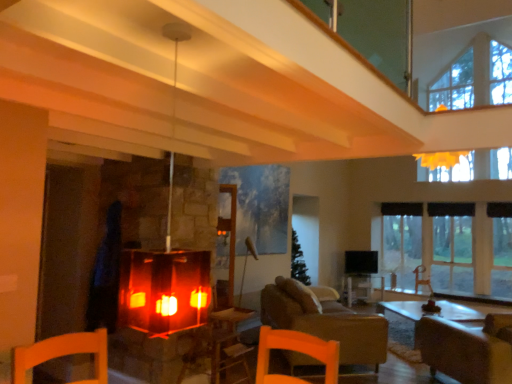
Locate an element on the screen. This screenshot has width=512, height=384. wooden table at center is located at coordinates (362, 288).

What do you see at coordinates (402, 209) in the screenshot? This screenshot has height=384, width=512. I see `black fabric curtain at right` at bounding box center [402, 209].

Where is `matte glass fireplace at center`? This screenshot has height=384, width=512. matte glass fireplace at center is located at coordinates (164, 284).

Can we say black fabric curtain at right lies outside brown leather armchair at lower right, arranged as the first armchair when viewed from the right?

black fabric curtain at right lies outside brown leather armchair at lower right, arranged as the first armchair when viewed from the right,'s area.

Is point (417, 207) closer or farther from the camera than point (422, 273)?

Point (417, 207) is positioned farther from the camera compared to point (422, 273).

Is black fabric curtain at right positioned in front of brown leather armchair at lower right, the second armchair viewed from the left?

No, it is not.

From the image's perspective, is black fabric curtain at right on brown leather armchair at lower right, the second armchair from the front?

Yes, from the image's perspective, black fabric curtain at right is on top of brown leather armchair at lower right, the second armchair from the front.

From the image's perspective, does brown leather armchair at lower right, the second armchair positioned from the right, appear lower than black fabric curtain at right?

Yes.

Is brown leather armchair at lower right, the 1th armchair positioned from the left, far from black fabric curtain at right?

brown leather armchair at lower right, the 1th armchair positioned from the left, is far away from black fabric curtain at right.

Is point (493, 333) in front of point (396, 214)?

Yes.

Which is more to the right, brown leather armchair at lower right, the 1th armchair positioned from the left, or black fabric curtain at right?

From the viewer's perspective, black fabric curtain at right appears more on the right side.

Between black fabric curtain at right and brown leather armchair at lower right, which ranks as the second armchair in back-to-front order, which one has larger size?

brown leather armchair at lower right, which ranks as the second armchair in back-to-front order.

From a real-world perspective, is black fabric curtain at right physically below brown leather armchair at lower right, which ranks as the second armchair in back-to-front order?

No, from a real-world perspective, black fabric curtain at right is not below brown leather armchair at lower right, which ranks as the second armchair in back-to-front order.

From the picture: Considering the sizes of black fabric curtain at right and brown leather armchair at lower right, the second armchair positioned from the right, in the image, is black fabric curtain at right wider or thinner than brown leather armchair at lower right, the second armchair positioned from the right,?

Clearly, black fabric curtain at right has less width compared to brown leather armchair at lower right, the second armchair positioned from the right.

Is black fabric curtain at right to the right of brown leather armchair at lower right, which ranks as the second armchair in back-to-front order, from the viewer's perspective?

Correct, you'll find black fabric curtain at right to the right of brown leather armchair at lower right, which ranks as the second armchair in back-to-front order.

Is wooden table at center inside or outside of brown leather armchair at lower right, the 1th armchair positioned from the left?

wooden table at center is spatially situated outside brown leather armchair at lower right, the 1th armchair positioned from the left.

Who is bigger, wooden table at center or brown leather armchair at lower right, the 1th armchair positioned from the left?

brown leather armchair at lower right, the 1th armchair positioned from the left, is bigger.

Locate an element on the screen. This screenshot has height=384, width=512. the 2nd armchair above the wooden table at center (from the image's perspective) is located at coordinates (468, 349).

From a real-world perspective, is wooden table at center physically below brown leather armchair at lower right, the 1th armchair from the front?

Yes, from a real-world perspective, wooden table at center is below brown leather armchair at lower right, the 1th armchair from the front.

From a real-world perspective, is black fabric curtain at right located beneath wooden table at center?

No.

Is black fabric curtain at right next to wooden table at center and touching it?

No, black fabric curtain at right is not in contact with wooden table at center.

Is black fabric curtain at right taller than wooden table at center?

No, black fabric curtain at right is not taller than wooden table at center.

From the picture: Who is taller, transparent glass window at right or brown leather armchair at lower right, the second armchair from the front?

transparent glass window at right is taller.

Is transparent glass window at right next to brown leather armchair at lower right, arranged as the first armchair when viewed from the right?

No, transparent glass window at right is not with brown leather armchair at lower right, arranged as the first armchair when viewed from the right.

From the image's perspective, is transparent glass window at right located beneath brown leather armchair at lower right, positioned as the 1th armchair in back-to-front order?

Actually, transparent glass window at right appears above brown leather armchair at lower right, positioned as the 1th armchair in back-to-front order, in the image.

Looking at this image, is transparent glass window at right turned away from brown leather armchair at lower right, arranged as the first armchair when viewed from the right?

Yes, transparent glass window at right is positioned with its back facing brown leather armchair at lower right, arranged as the first armchair when viewed from the right.

Who is more distant, leather couch at center or black fabric curtain at right?

Positioned behind is black fabric curtain at right.

Where is `studio couch below the black fabric curtain at right (from the image's perspective)`? Image resolution: width=512 pixels, height=384 pixels. studio couch below the black fabric curtain at right (from the image's perspective) is located at coordinates (325, 321).

Could you tell me if leather couch at center is turned towards black fabric curtain at right?

No, leather couch at center is not aimed at black fabric curtain at right.

How different are the orientations of leather couch at center and black fabric curtain at right in degrees?

They differ by 137 degrees in their facing directions.

Locate an element on the screen. The image size is (512, 384). curtain on the left of the brown leather armchair at lower right, arranged as the first armchair when viewed from the right is located at coordinates (402, 209).

From a real-world perspective, count 2nd armchairs downward from the black fabric curtain at right and point to it. Please provide its 2D coordinates.

[(468, 349)]

Which object lies nearer to the anchor point matte glass fireplace at center, wooden table at center or brown leather armchair at lower right, which ranks as the second armchair in back-to-front order?

Based on the image, brown leather armchair at lower right, which ranks as the second armchair in back-to-front order, appears to be nearer to matte glass fireplace at center.

Looking at the image, which one is located further to wooden table at center, transparent glass window at right or matte glass fireplace at center?

Among the two, matte glass fireplace at center is located further to wooden table at center.

From the image, which object appears to be nearer to leather couch at center, brown leather armchair at lower right, the second armchair positioned from the right, or transparent glass window at right?

brown leather armchair at lower right, the second armchair positioned from the right, is closer to leather couch at center.

Looking at this image, estimate the real-world distances between objects in this image. Which object is further from wooden table at center, transparent glass window at right or brown leather armchair at lower right, the 1th armchair positioned from the left?

The object further to wooden table at center is brown leather armchair at lower right, the 1th armchair positioned from the left.

Based on their spatial positions, is transparent glass window at right or wooden table at center closer to black fabric curtain at right?

transparent glass window at right is positioned closer to the anchor black fabric curtain at right.

From the image, which object appears to be farther from brown leather armchair at lower right, which ranks as the second armchair in back-to-front order, transparent glass window at right or wooden table at center?

Based on the image, transparent glass window at right appears to be further to brown leather armchair at lower right, which ranks as the second armchair in back-to-front order.

Based on their spatial positions, is brown leather armchair at lower right, the second armchair viewed from the left, or leather couch at center further from matte glass fireplace at center?

brown leather armchair at lower right, the second armchair viewed from the left.

From the image, which object appears to be farther from leather couch at center, black fabric curtain at right or transparent glass window at right?

black fabric curtain at right is positioned further to the anchor leather couch at center.

The height and width of the screenshot is (384, 512). In order to click on window located between matte glass fireplace at center and wooden table at center in the depth direction in this screenshot , I will do `click(452, 248)`.

Image resolution: width=512 pixels, height=384 pixels. Identify the location of window between brown leather armchair at lower right, the 1th armchair from the front, and wooden table at center in the front-back direction. (452, 248).

This screenshot has width=512, height=384. I want to click on studio couch between matte glass fireplace at center and wooden table at center along the z-axis, so click(325, 321).

You are a GUI agent. You are given a task and a screenshot of the screen. Output one action in this format:
    pyautogui.click(x=<x>, y=<y>)
    Task: Click on the studio couch between brown leather armchair at lower right, the 1th armchair positioned from the left, and black fabric curtain at right from front to back
    This screenshot has width=512, height=384.
    Given the screenshot: What is the action you would take?
    pyautogui.click(x=325, y=321)